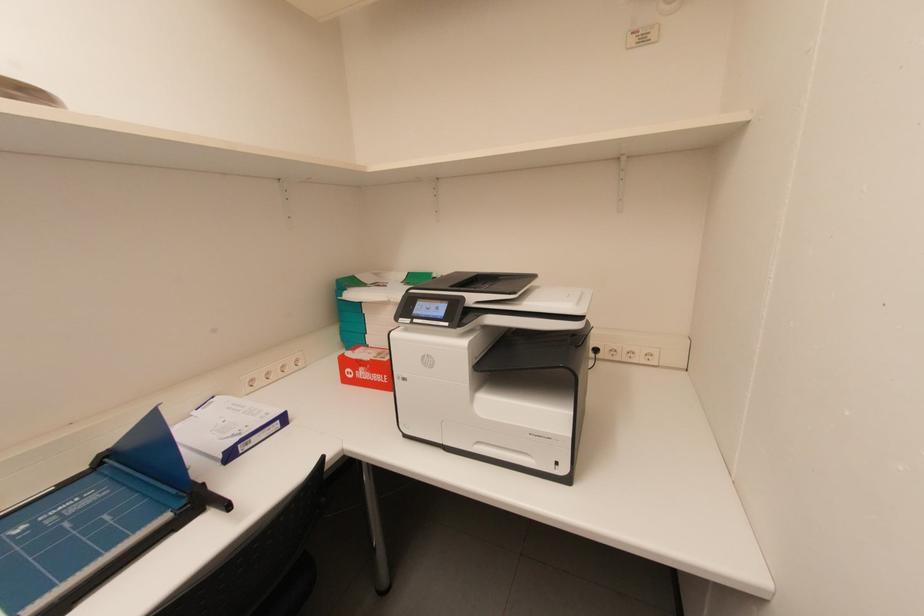
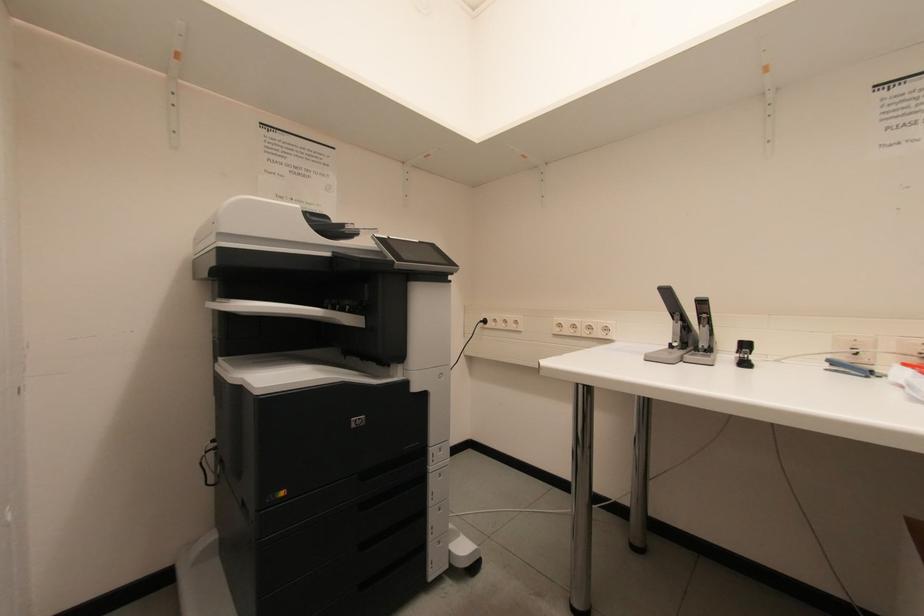
Question: The camera is either moving clockwise (left) or counter-clockwise (right) around the object. The first image is from the beginning of the video and the second image is from the end. Is the camera moving left or right when shooting the video?

Choices:
 (A) Left
 (B) Right

Answer: (B)